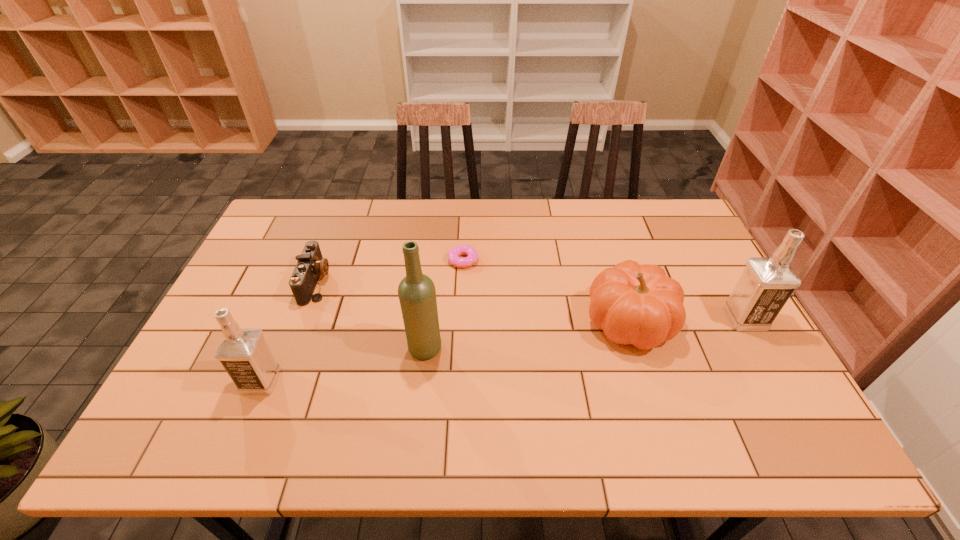
Identify the location of the nearest object. The width and height of the screenshot is (960, 540). (243, 352).

Where is `the nearer vodka`? The width and height of the screenshot is (960, 540). the nearer vodka is located at coordinates click(243, 352).

The height and width of the screenshot is (540, 960). I want to click on the taller vodka, so click(x=765, y=285).

Identify the location of the right vodka. (765, 285).

Locate an element on the screen. The image size is (960, 540). doughnut is located at coordinates (453, 255).

Identify the location of wine bottle. This screenshot has width=960, height=540. (417, 295).

Locate an element on the screen. The height and width of the screenshot is (540, 960). camera is located at coordinates (311, 264).

Where is `the fourth tallest object`? Image resolution: width=960 pixels, height=540 pixels. the fourth tallest object is located at coordinates (635, 304).

Where is `the second object from right to left`? Image resolution: width=960 pixels, height=540 pixels. the second object from right to left is located at coordinates (635, 304).

The image size is (960, 540). Identify the location of vacant space situated on the front label of the nearest object. (196, 381).